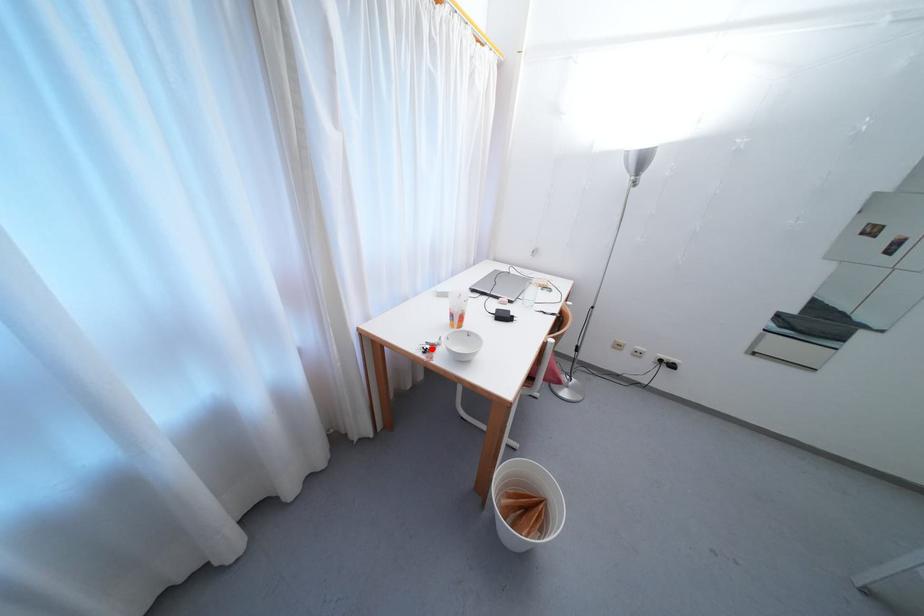
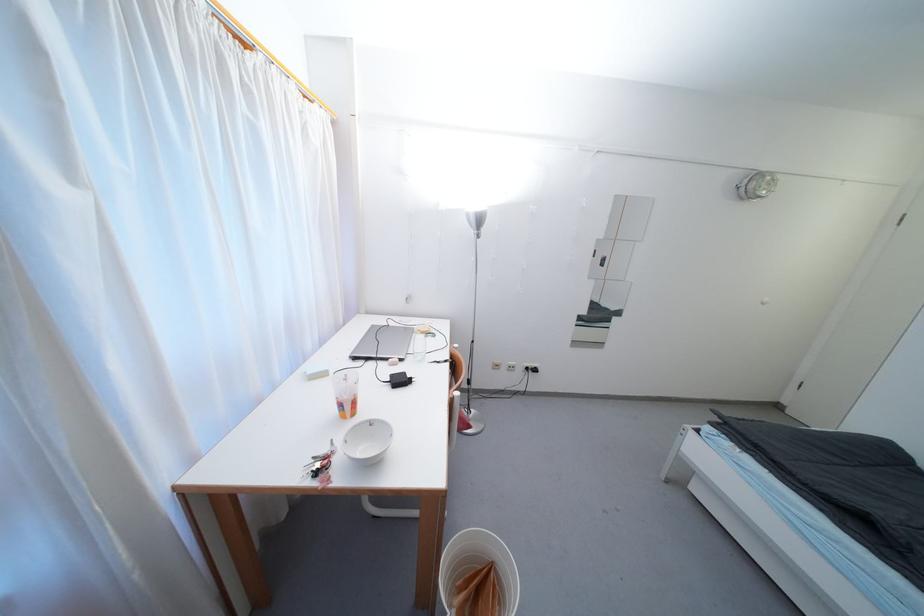
The point at the highlighted location is marked in the first image. Where is the corresponding point in the second image?

(322, 468)